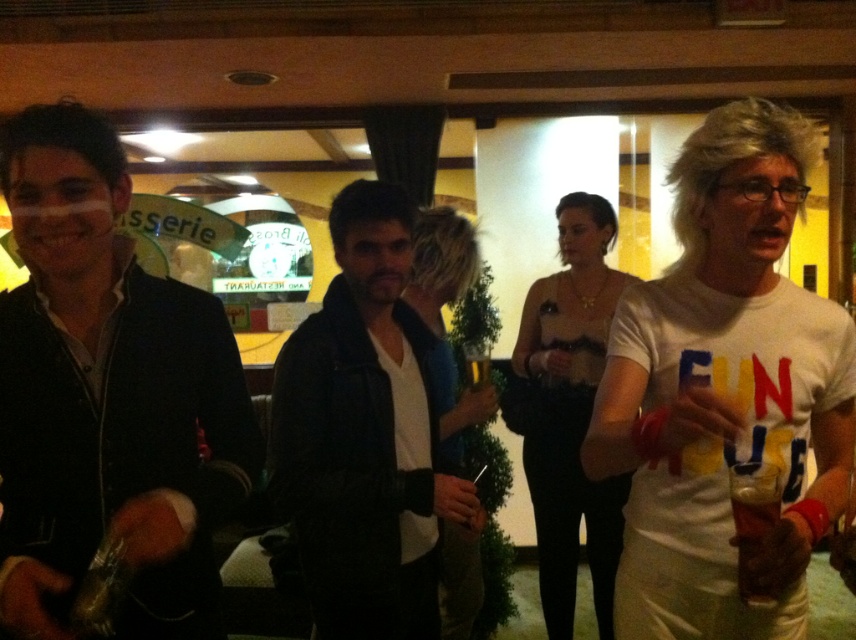
Question: Estimate the real-world distances between objects in this image. Which object is farther from the white cotton t-shirt at center?

Choices:
 (A) translucent glass at right
 (B) matte black jacket at left

Answer: (B)

Question: Which point is farther from the camera taking this photo?

Choices:
 (A) (435, 541)
 (B) (744, 248)
 (C) (758, 488)
 (D) (117, 296)

Answer: (A)

Question: Can you confirm if white cotton t-shirt at center is positioned below matte black jacket at left?

Choices:
 (A) no
 (B) yes

Answer: (B)

Question: In this image, where is matte black jacket at left located relative to translucent glass at right?

Choices:
 (A) right
 (B) left

Answer: (B)

Question: Among these points, which one is farthest from the camera?

Choices:
 (A) (734, 483)
 (B) (51, 532)

Answer: (B)

Question: Can you confirm if white cotton t-shirt at center is positioned below translucent glass at right?

Choices:
 (A) no
 (B) yes

Answer: (A)